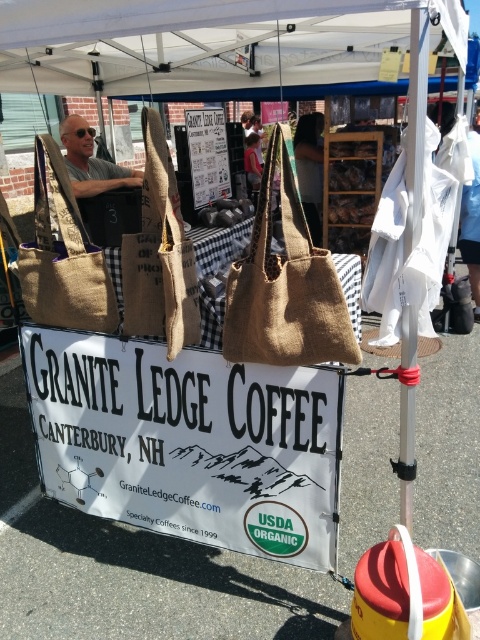
Question: Which point appears farthest from the camera in this image?

Choices:
 (A) (122, 170)
 (B) (48, 371)
 (C) (107, 321)
 (D) (244, 273)

Answer: (A)

Question: Does burlap tote bag at center have a larger size compared to burlap tote at left?

Choices:
 (A) no
 (B) yes

Answer: (B)

Question: Can you confirm if white paper sign at center is bigger than burlap tote bag at center?

Choices:
 (A) yes
 (B) no

Answer: (A)

Question: Is burlap tote at left bigger than matte gray hair at upper left?

Choices:
 (A) yes
 (B) no

Answer: (B)

Question: Based on their relative distances, which object is farther from the white paper sign at center?

Choices:
 (A) matte gray hair at upper left
 (B) burlap tote at left
 (C) burlap tote bag at center

Answer: (A)

Question: Estimate the real-world distances between objects in this image. Which object is closer to the matte gray hair at upper left?

Choices:
 (A) burlap tote bag at center
 (B) burlap tote at left
 (C) white paper sign at center

Answer: (B)